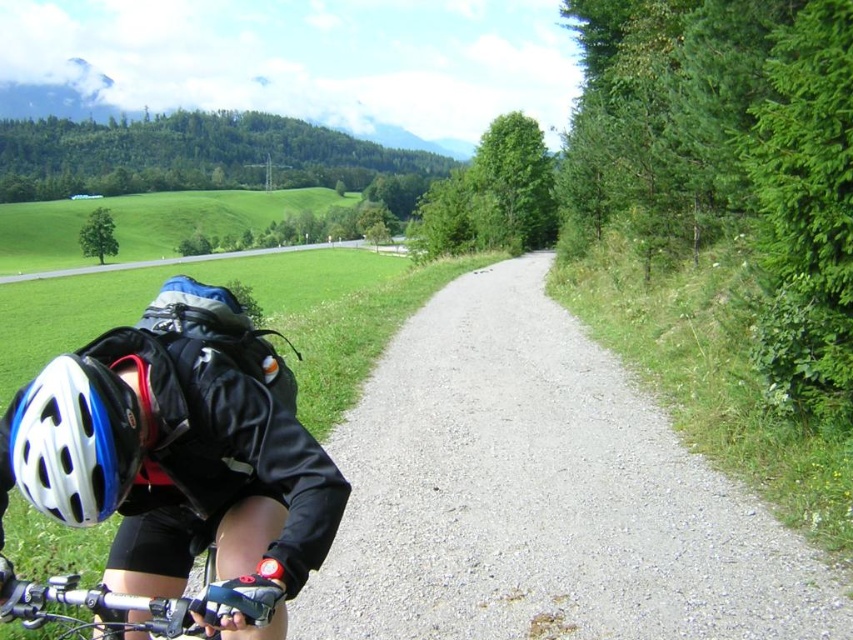
You are a cyclist who wants to check if your white matte bicycle helmet at lower left is visible in the image. The image has a coordinate system where the bottom left corner is the origin point. The point given is at [74,440]. Is your white matte bicycle helmet at lower left located at that coordinate?

Yes, the point at [74,440] marks the white matte bicycle helmet at lower left, so it is located there.

You are a cyclist navigating a rural route and see the gray gravel path at center. Based on its position, can you estimate whether it curves to the left or right ahead?

The gray gravel path at center is located at point coordinates, but without additional information about the curvature or direction changes in the path, it is impossible to determine if it curves left or right ahead. The provided data only specifies its central position, not its trajectory or bends.